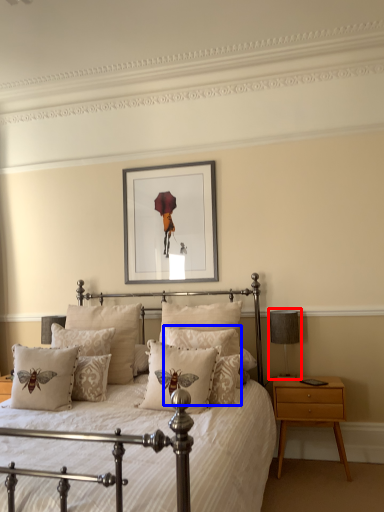
Question: Which object is closer to the camera taking this photo, table lamp (highlighted by a red box) or pillow (highlighted by a blue box)?

Choices:
 (A) table lamp
 (B) pillow

Answer: (B)